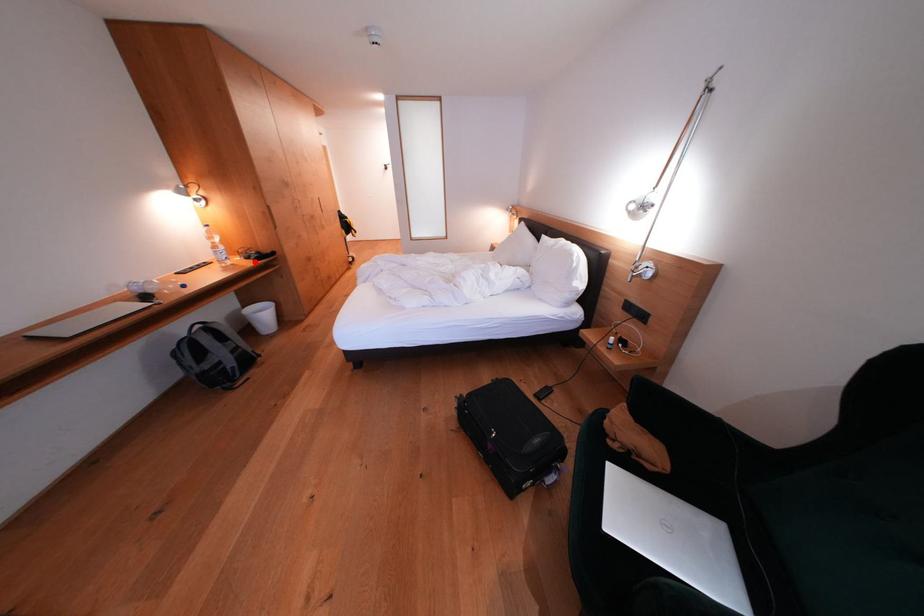
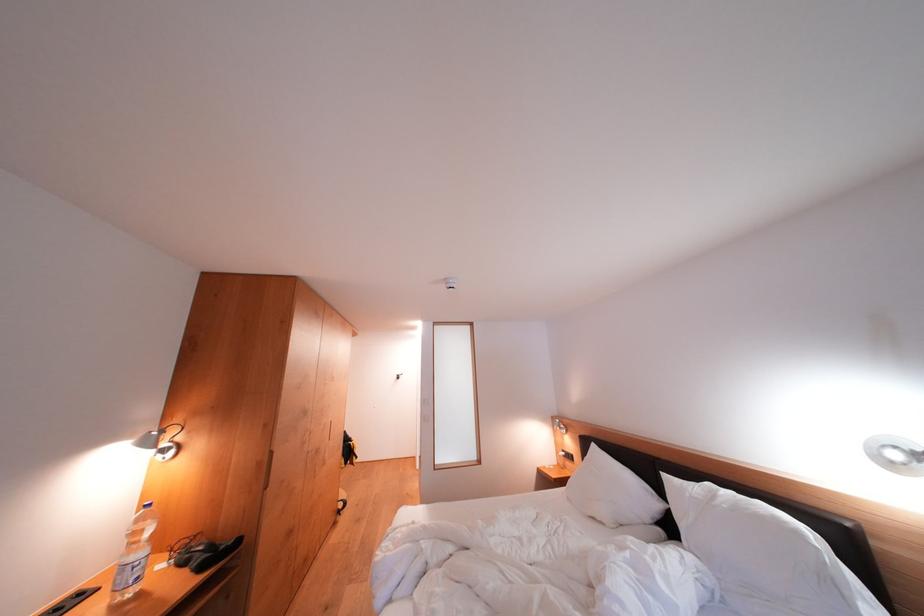
Locate, in the second image, the point that corresponds to the highlighted location in the first image.

(190, 567)